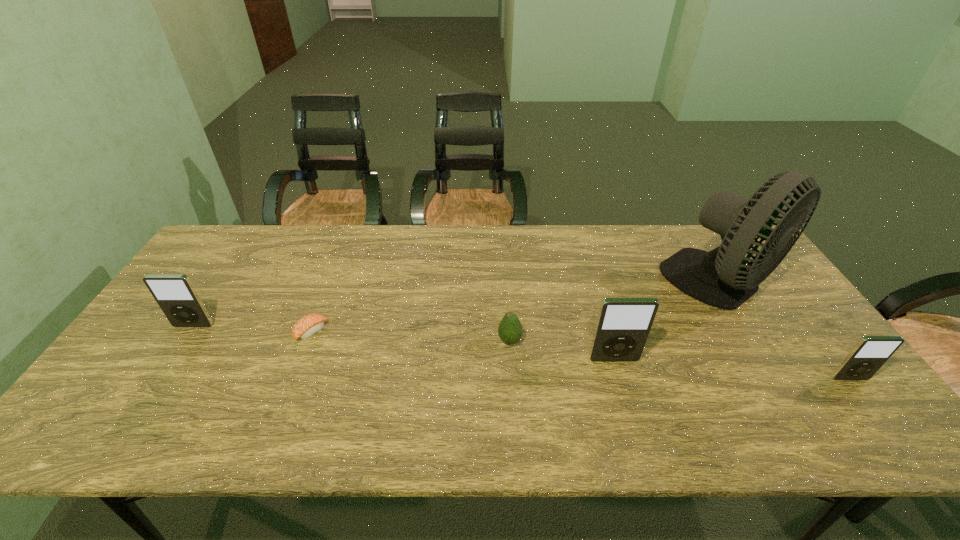
Where is `vacant spot for a new iPod to ensure equal spacing`? The width and height of the screenshot is (960, 540). vacant spot for a new iPod to ensure equal spacing is located at coordinates (396, 342).